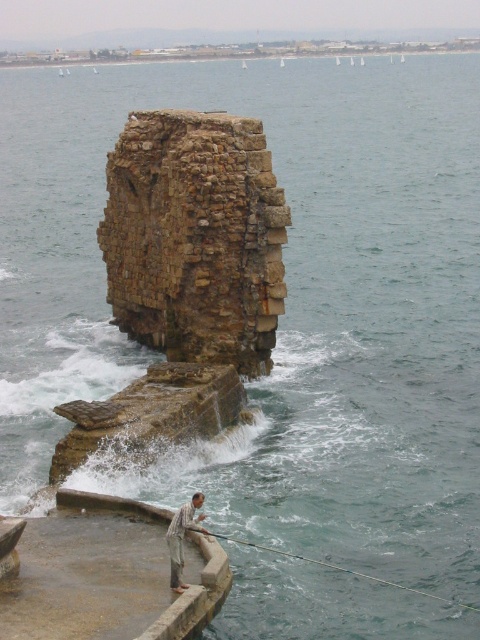
You are a photographer trying to capture the entire rusty stone pillar at center and the light gray cotton shirt at lower center in one frame. Which object should you focus on first to ensure both are in the frame?

The rusty stone pillar at center is bigger than the light gray cotton shirt at lower center, so you should focus on the rusty stone pillar at center first to ensure both are in the frame.

You are standing on the smooth concrete dock at lower left and want to reach the light gray cotton shirt at lower center. Which direction should you move to get closer to the shirt?

To reach the light gray cotton shirt at lower center from the smooth concrete dock at lower left, you should move upward since the dock is located below the shirt.

Looking at this image, you are a tourist visiting the coastal area and want to take a photo of the rusty stone pillar at center and the smooth concrete dock at lower left. Which object should you focus on first if you want to capture both in a single frame without moving the camera?

Since the rusty stone pillar at center is larger in size compared to the smooth concrete dock at lower left, you should focus on the rusty stone pillar at center first to ensure it fits properly in the frame before adjusting for the smaller dock.